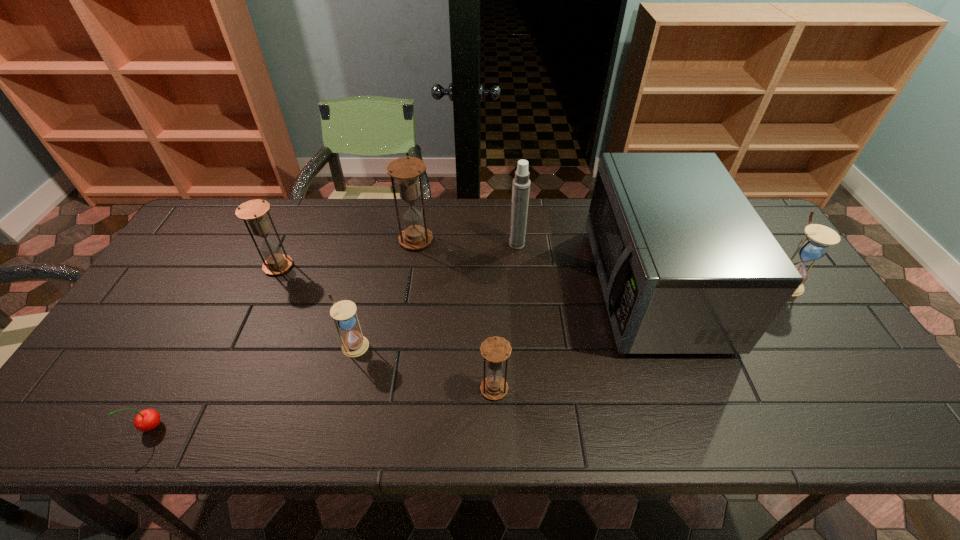
Locate an element on the screen. vacant space in between the microwave oven and the second nearest brown hourglass is located at coordinates (466, 276).

I want to click on vacant space in between the white aerosol can and the third hourglass from left to right, so 467,242.

The width and height of the screenshot is (960, 540). Find the location of `vacant area between the microwave oven and the second nearest hourglass`. vacant area between the microwave oven and the second nearest hourglass is located at coordinates (503, 316).

Locate an element on the screen. The width and height of the screenshot is (960, 540). empty location between the leftmost object and the third object from left to right is located at coordinates (253, 386).

Where is `free space between the microwave oven and the rightmost brown hourglass`? This screenshot has height=540, width=960. free space between the microwave oven and the rightmost brown hourglass is located at coordinates (573, 338).

Locate an element on the screen. The height and width of the screenshot is (540, 960). object that can be found as the closest to the microwave oven is located at coordinates (814, 246).

Point out which object is positioned as the seventh nearest to the microwave oven. Please provide its 2D coordinates. Your answer should be formatted as a tuple, i.e. [(x, y)], where the tuple contains the x and y coordinates of a point satisfying the conditions above.

[(146, 420)]

Identify which hourglass is the second nearest to the sixth object from right to left. Please provide its 2D coordinates. Your answer should be formatted as a tuple, i.e. [(x, y)], where the tuple contains the x and y coordinates of a point satisfying the conditions above.

[(254, 211)]

Choose which hourglass is the fourth nearest neighbor to the nearer white hourglass. Please provide its 2D coordinates. Your answer should be formatted as a tuple, i.e. [(x, y)], where the tuple contains the x and y coordinates of a point satisfying the conditions above.

[(814, 246)]

In order to click on the second closest brown hourglass relative to the shortest object in this screenshot , I will do `click(406, 170)`.